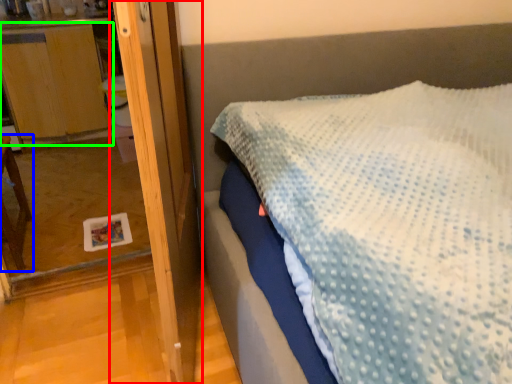
Question: Which is nearer to the screen door (highlighted by a red box)? furniture (highlighted by a blue box) or dresser (highlighted by a green box).

Choices:
 (A) furniture
 (B) dresser

Answer: (A)